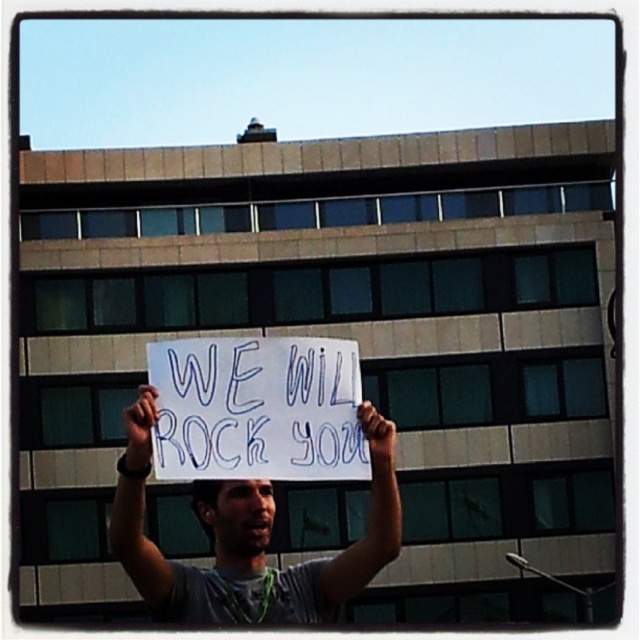
Question: Among these points, which one is nearest to the camera?

Choices:
 (A) (141, 396)
 (B) (292, 429)
 (C) (140, 497)
 (D) (372, 445)

Answer: (C)

Question: Among these points, which one is farthest from the camera?

Choices:
 (A) (147, 419)
 (B) (362, 406)

Answer: (B)

Question: Does gray fabric shirt at center appear over smooth skin hand at upper center?

Choices:
 (A) no
 (B) yes

Answer: (A)

Question: Which of these objects is positioned farthest from the smooth skin hand at center?

Choices:
 (A) white paper sign at center
 (B) smooth skin hand at upper center

Answer: (B)

Question: Is gray fabric shirt at center smaller than smooth skin hand at upper center?

Choices:
 (A) yes
 (B) no

Answer: (A)

Question: Is gray fabric shirt at center further to camera compared to smooth skin hand at upper center?

Choices:
 (A) yes
 (B) no

Answer: (B)